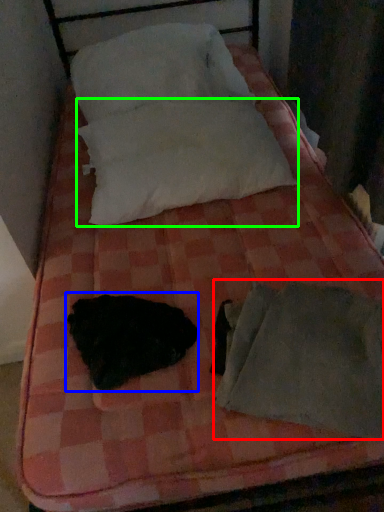
Question: Which is farther away from sleeping bag (highlighted by a red box)? animal (highlighted by a blue box) or pillow (highlighted by a green box)?

Choices:
 (A) animal
 (B) pillow

Answer: (B)